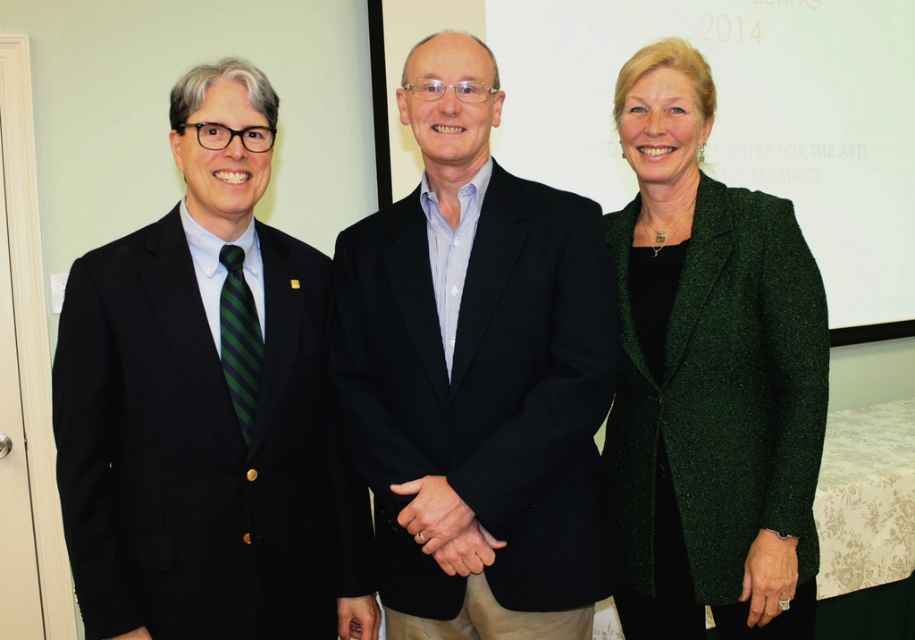
Does black matte suit at center have a greater width compared to green textured blazer at center?

Yes, black matte suit at center is wider than green textured blazer at center.

Which is below, black matte suit at center or green textured blazer at center?

Positioned lower is green textured blazer at center.

Who is more distant from viewer, (397, 339) or (673, 612)?

Positioned behind is point (673, 612).

Locate an element on the screen. This screenshot has height=640, width=915. black matte suit at center is located at coordinates (476, 376).

Which of these two, matte black suit at left or black matte suit at center, stands taller?

Standing taller between the two is black matte suit at center.

The height and width of the screenshot is (640, 915). What do you see at coordinates (205, 404) in the screenshot? I see `matte black suit at left` at bounding box center [205, 404].

Find the location of a particular element. This screenshot has width=915, height=640. matte black suit at left is located at coordinates (205, 404).

Between matte black suit at left and green textured blazer at center, which one is positioned higher?

green textured blazer at center is higher up.

Can you confirm if matte black suit at left is thinner than green textured blazer at center?

No.

Where is `matte black suit at left`? Image resolution: width=915 pixels, height=640 pixels. matte black suit at left is located at coordinates (205, 404).

Where is `matte black suit at left`? This screenshot has width=915, height=640. matte black suit at left is located at coordinates (205, 404).